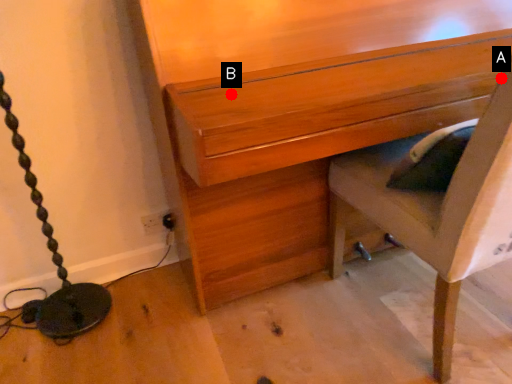
Question: Two points are circled on the image, labeled by A and B beside each circle. Which point is closer to the camera taking this photo?

Choices:
 (A) A is closer
 (B) B is closer

Answer: (A)